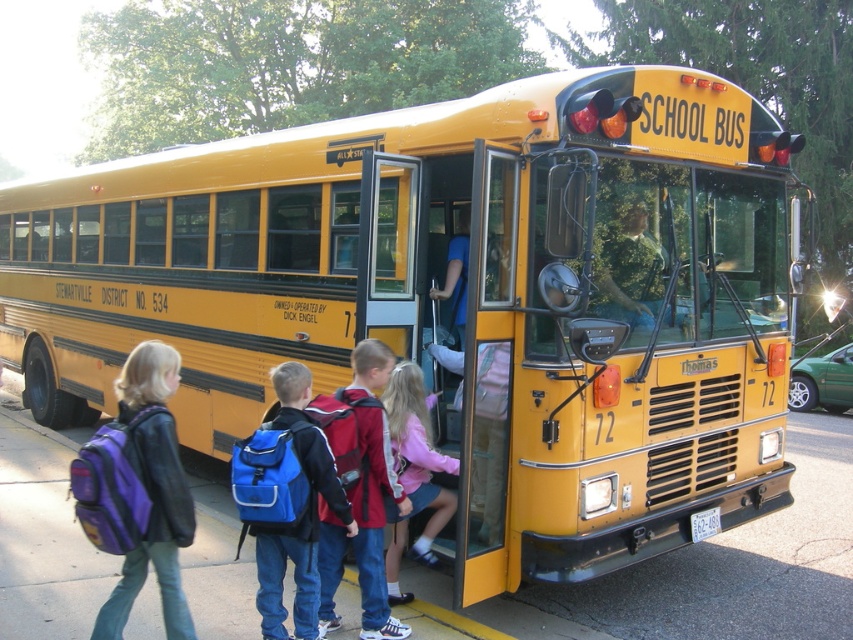
You are a parent looking for your child who has a red backpack. The bus driver tells you that the red backpack at center is located at coordinate point 0.770, 0.423. Based on the image, where should you direct your child to retrieve their backpack?

The red backpack at center is located at coordinate point (360, 492), so you should direct your child to look near the center of the bus.

You are a parent waiting to pick up your child from school. You notice two items at the center of the bus interior. Which item is higher up between the red backpack at center and the matte pink sweater at center?

The red backpack at center is located above the matte pink sweater at center.

You are a parent trying to locate your child who is carrying a purple matte backpack at left and a blue fabric backpack at center. Based on the scene, which backpack is closer to the open doors of the school bus?

The purple matte backpack at left is positioned on the left side of the blue fabric backpack at center, so the purple matte backpack at left is closer to the open doors of the school bus since it is on the left side.